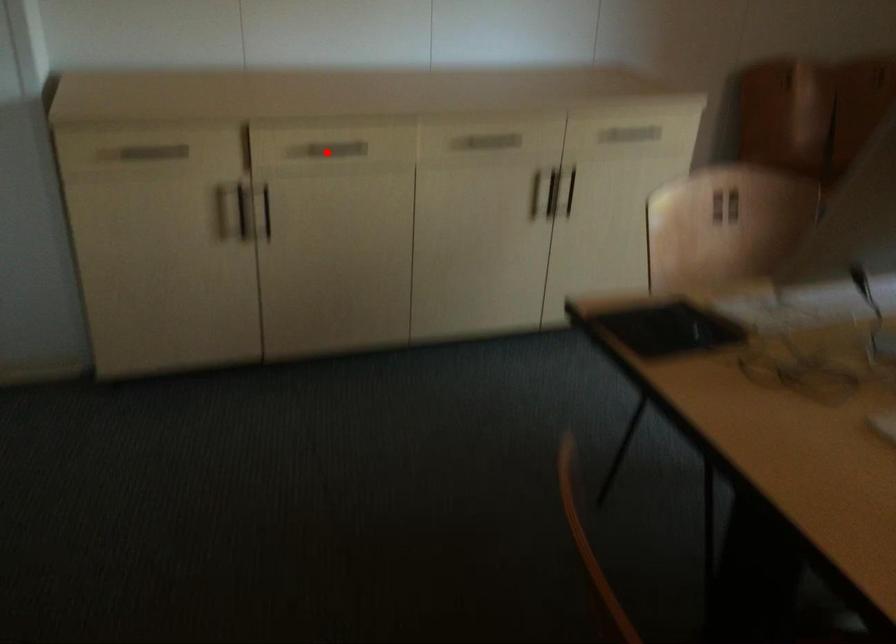
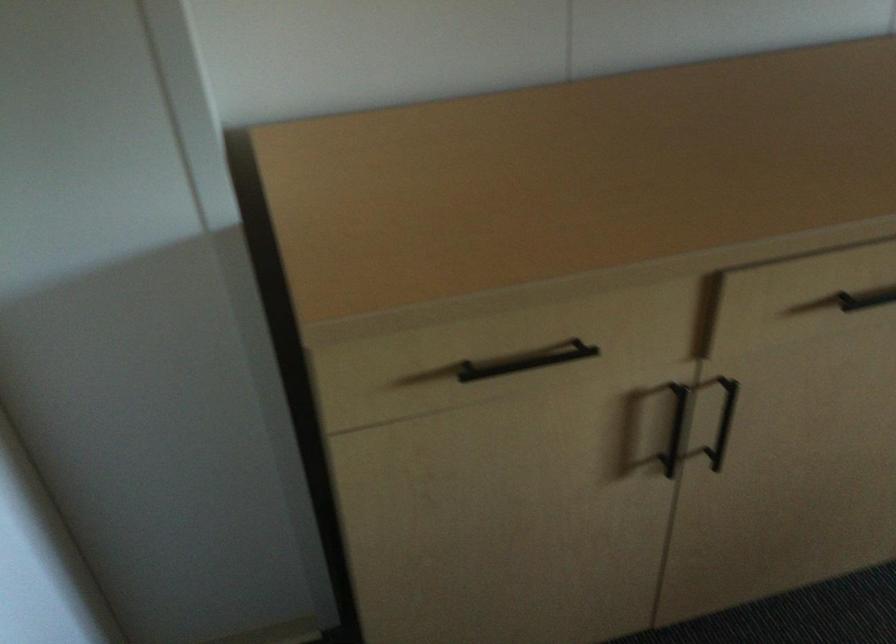
Find the pixel in the second image that matches the highlighted location in the first image.

(866, 299)